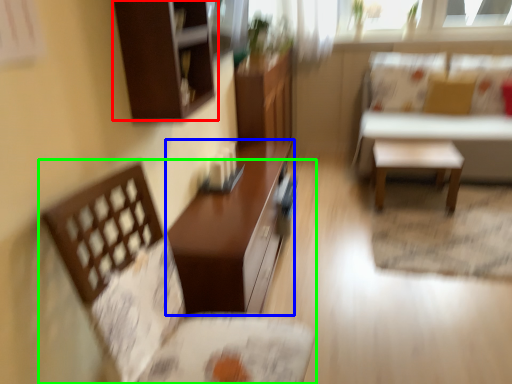
Question: Which object is the closest to the cabinetry (highlighted by a red box)? Choose among these: table (highlighted by a blue box) or chair (highlighted by a green box).

Choices:
 (A) table
 (B) chair

Answer: (B)